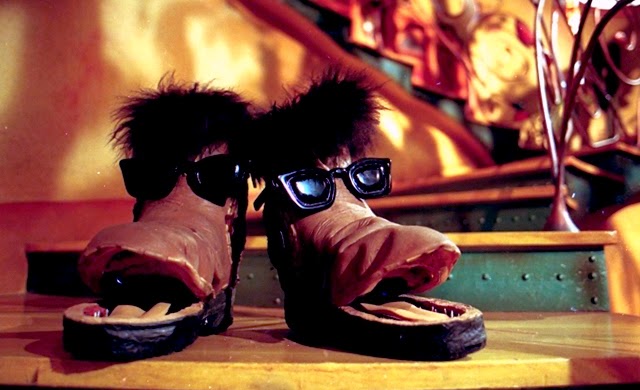
Where is `risers`? risers is located at coordinates (536, 252), (527, 217), (527, 176).